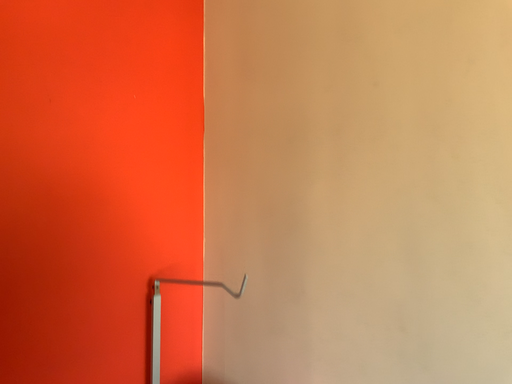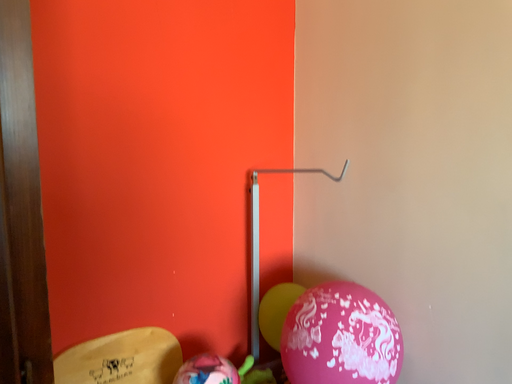
Question: How did the camera likely rotate when shooting the video?

Choices:
 (A) rotated upward
 (B) rotated downward

Answer: (B)